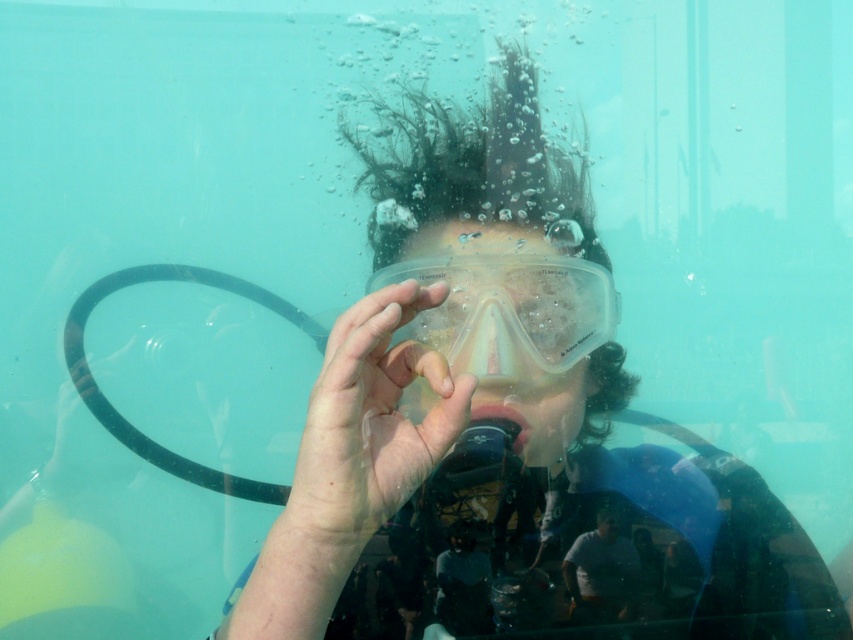
You are an underwater photographer capturing the diver. You need to focus your camera on the transparent plastic goggles at center and the gray matte shirt at center. Which object should you focus on first to ensure clarity?

The transparent plastic goggles at center is in front of the gray matte shirt at center, so you should focus on the transparent plastic goggles at center first to ensure clarity.

You are a scuba diver preparing to adjust your mask. You notice a point at coordinates (368, 426). Is this point where your hand is currently positioned?

The transparent plastic hand at center is located at point (368, 426), so yes, the point at coordinates (368, 426) is where your hand is currently positioned.